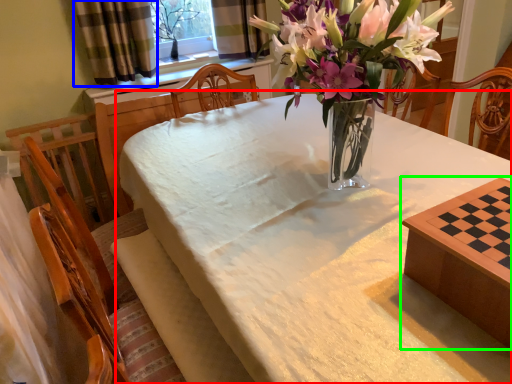
Question: Which is farther away from table (highlighted by a red box)? curtain (highlighted by a blue box) or table (highlighted by a green box)?

Choices:
 (A) curtain
 (B) table

Answer: (A)